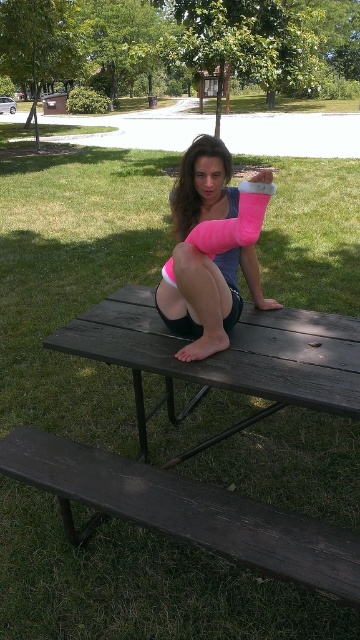
Question: Which point is farther from the camera taking this photo?

Choices:
 (A) (178, 234)
 (B) (246, 374)
 (C) (210, 518)

Answer: (A)

Question: Is the position of dark brown wooden bench at lower left more distant than that of pink foam cast at center?

Choices:
 (A) yes
 (B) no

Answer: (B)

Question: Is dark brown wooden bench at lower left below dark wood picnic table at center?

Choices:
 (A) yes
 (B) no

Answer: (A)

Question: Which point is closer to the camera?

Choices:
 (A) (123, 307)
 (B) (239, 305)

Answer: (B)

Question: From the image, what is the correct spatial relationship of dark brown wooden bench at lower left in relation to pink foam cast at center?

Choices:
 (A) below
 (B) above

Answer: (A)

Question: Estimate the real-world distances between objects in this image. Which object is closer to the dark brown wooden bench at lower left?

Choices:
 (A) dark wood picnic table at center
 (B) pink foam cast at center

Answer: (A)